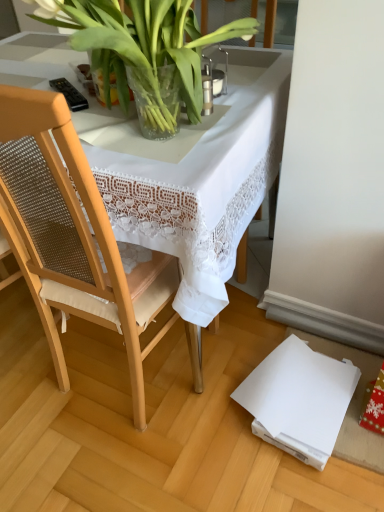
Question: From the image's perspective, is wooden chair at left located above white lace tablecloth at center?

Choices:
 (A) yes
 (B) no

Answer: (B)

Question: Is wooden chair at left taller than white lace tablecloth at center?

Choices:
 (A) no
 (B) yes

Answer: (B)

Question: Is wooden chair at left positioned before white lace tablecloth at center?

Choices:
 (A) yes
 (B) no

Answer: (A)

Question: Considering the relative sizes of wooden chair at left and white lace tablecloth at center in the image provided, is wooden chair at left wider than white lace tablecloth at center?

Choices:
 (A) yes
 (B) no

Answer: (B)

Question: Is wooden chair at left beside white lace tablecloth at center?

Choices:
 (A) no
 (B) yes

Answer: (A)

Question: Based on their sizes in the image, would you say wooden chair at left is bigger or smaller than clear glass vase at upper center?

Choices:
 (A) small
 (B) big

Answer: (B)

Question: From the image's perspective, is wooden chair at left positioned above or below clear glass vase at upper center?

Choices:
 (A) above
 (B) below

Answer: (B)

Question: From a real-world perspective, is wooden chair at left positioned above or below clear glass vase at upper center?

Choices:
 (A) above
 (B) below

Answer: (B)

Question: In the image, is wooden chair at left on the left side or the right side of clear glass vase at upper center?

Choices:
 (A) left
 (B) right

Answer: (A)

Question: Looking at their shapes, would you say wooden chair at left is wider or thinner than white lace tablecloth at center?

Choices:
 (A) thin
 (B) wide

Answer: (A)

Question: From the image's perspective, is wooden chair at left positioned above or below white lace tablecloth at center?

Choices:
 (A) below
 (B) above

Answer: (A)

Question: Looking at the image, does wooden chair at left seem bigger or smaller compared to white lace tablecloth at center?

Choices:
 (A) big
 (B) small

Answer: (B)

Question: From their relative heights in the image, would you say wooden chair at left is taller or shorter than white lace tablecloth at center?

Choices:
 (A) tall
 (B) short

Answer: (A)

Question: Is clear glass vase at upper center inside or outside of wooden chair at left?

Choices:
 (A) outside
 (B) inside

Answer: (B)

Question: From the image's perspective, is clear glass vase at upper center positioned above or below wooden chair at left?

Choices:
 (A) below
 (B) above

Answer: (B)